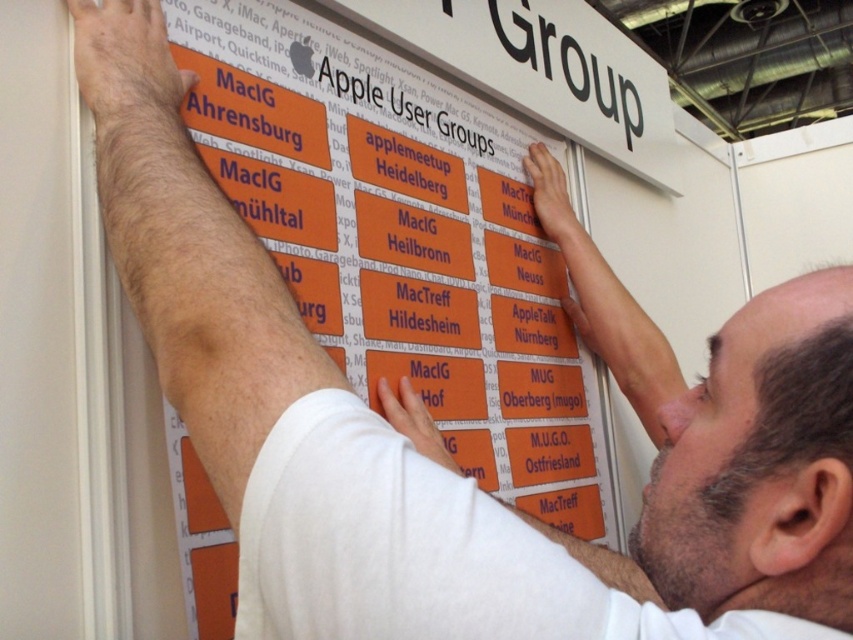
You are at an Apple user group event and want to find the location of the orange matte sign at upper center and orange matte sign at center. Based on the scene description, which sign is positioned higher on the display board?

The orange matte sign at center is positioned higher on the display board than the orange matte sign at upper center.

You are setting up a display board for Apple user groups. You have two orange matte signs to place. The orange matte sign at upper center and the orange matte sign at center. According to the spatial arrangement, which sign should you place first if you want to ensure the wider one is positioned higher up?

The orange matte sign at upper center is wider than the orange matte sign at center, so you should place the orange matte sign at upper center first to ensure the wider one is positioned higher up.